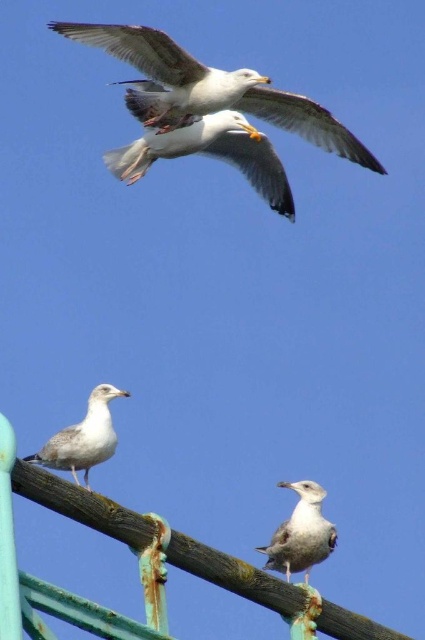
Does white feathered seagull at upper center have a lesser width compared to light gray feathered seagull at center?

Yes, white feathered seagull at upper center is thinner than light gray feathered seagull at center.

You are a GUI agent. You are given a task and a screenshot of the screen. Output one action in this format:
    pyautogui.click(x=<x>, y=<y>)
    Task: Click on the white feathered seagull at upper center
    
    Given the screenshot: What is the action you would take?
    pyautogui.click(x=210, y=154)

Which of these two, white feathered seagull at upper center or white feathered seagull at center, stands taller?

white feathered seagull at center is taller.

Who is more distant from viewer, (266,156) or (312,557)?

The point (266,156) is more distant.

Image resolution: width=425 pixels, height=640 pixels. I want to click on white feathered seagull at upper center, so click(x=210, y=154).

Which of these two, white feathered seagull at center or light gray feathered seagull at center, stands shorter?

Standing shorter between the two is light gray feathered seagull at center.

In the scene shown: Who is more forward, (300, 490) or (82, 429)?

Point (82, 429) is more forward.

Locate an element on the screen. white feathered seagull at center is located at coordinates click(x=300, y=532).

I want to click on white feathered seagull at center, so click(300, 532).